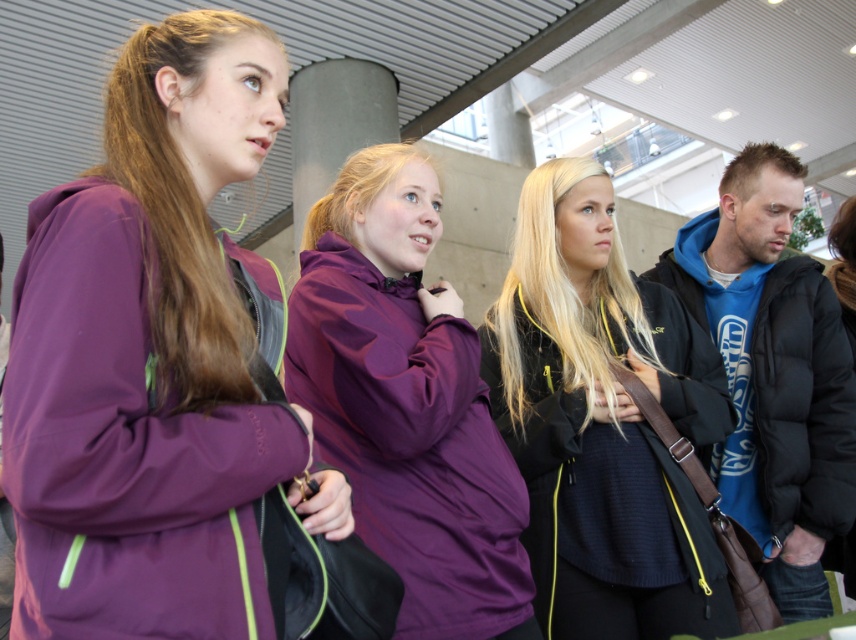
Between purple softshell jacket at left and blue fleece jacket at right, which one appears on the right side from the viewer's perspective?

blue fleece jacket at right

Can you confirm if purple softshell jacket at left is wider than blue fleece jacket at right?

In fact, purple softshell jacket at left might be narrower than blue fleece jacket at right.

Find the location of a particular element. purple softshell jacket at left is located at coordinates (147, 356).

Identify the location of purple softshell jacket at left. The image size is (856, 640). (147, 356).

Is black knit sweater at center further to camera compared to blue fleece jacket at right?

No.

Does point (539, 566) lie in front of point (843, 516)?

Yes, point (539, 566) is closer to viewer.

Identify the location of black knit sweater at center. (602, 422).

Locate an element on the screen. This screenshot has width=856, height=640. black knit sweater at center is located at coordinates (602, 422).

Who is higher up, purple matte jacket at center or blue fleece jacket at right?

Positioned higher is blue fleece jacket at right.

Between point (417, 372) and point (837, 456), which one is positioned behind?

Positioned behind is point (837, 456).

Between point (420, 378) and point (767, 422), which one is positioned in front?

Positioned in front is point (420, 378).

At what (x,y) coordinates should I click in order to perform the action: click on purple matte jacket at center. Please return your answer as a coordinate pair (x, y). The width and height of the screenshot is (856, 640). Looking at the image, I should click on (407, 403).